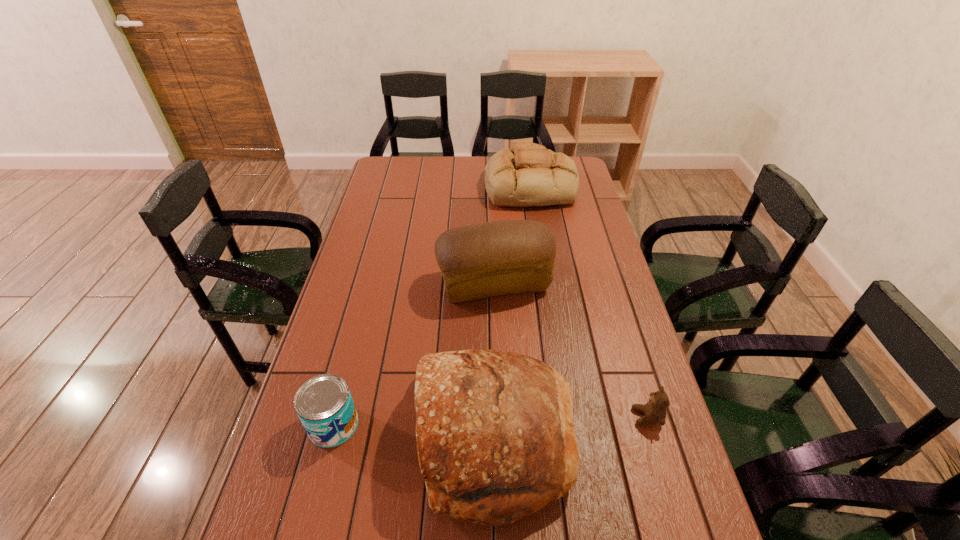
Select which bread is the closest to the teddy bear. Please provide its 2D coordinates. Your answer should be formatted as a tuple, i.e. [(x, y)], where the tuple contains the x and y coordinates of a point satisfying the conditions above.

[(495, 438)]

Choose which bread is the second nearest neighbor to the second farthest bread. Please provide its 2D coordinates. Your answer should be formatted as a tuple, i.e. [(x, y)], where the tuple contains the x and y coordinates of a point satisfying the conditions above.

[(528, 175)]

Locate an element on the screen. blank area in the image that satisfies the following two spatial constraints: 1. on the front side of the farthest bread; 2. at the sliced front of the nearest bread is located at coordinates (569, 437).